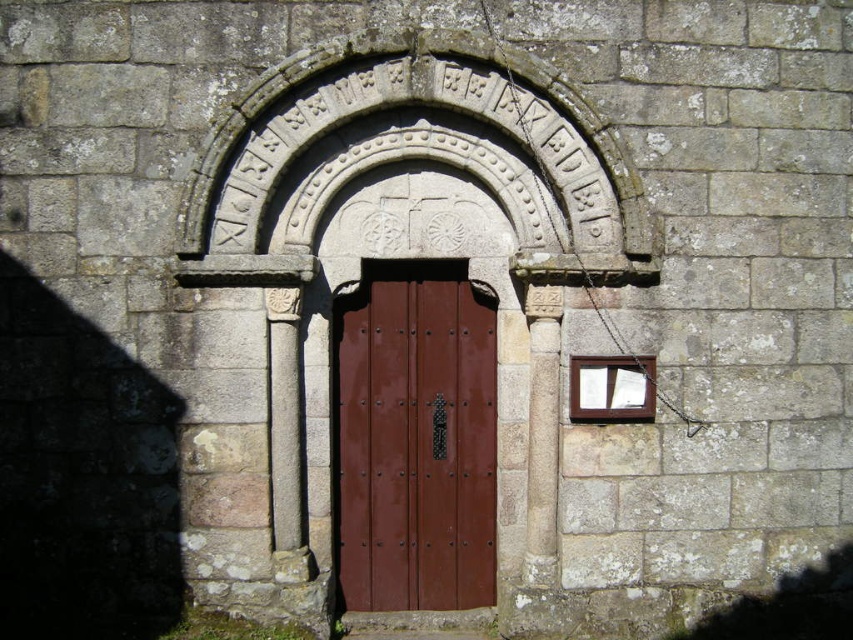
You are an architect inspecting the historical building. You notice the carved stone arch at center and the wooden window at right. Which one is positioned higher in the structure?

The carved stone arch at center is positioned higher than the wooden window at right.